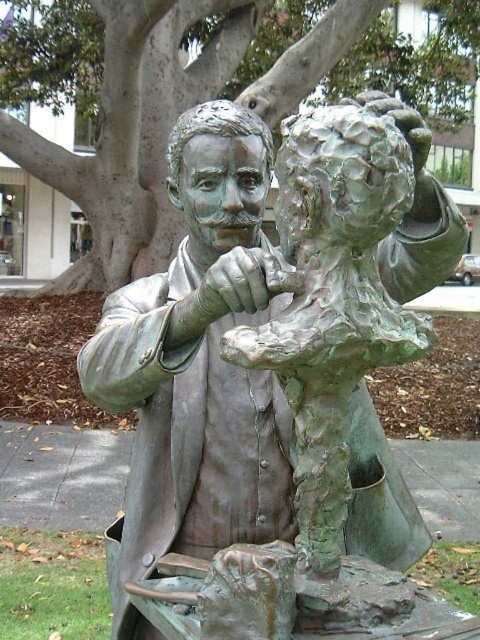
What do you see at coordinates (197, 365) in the screenshot? The height and width of the screenshot is (640, 480). I see `green patina bronze statue at center` at bounding box center [197, 365].

Between green patina bronze statue at center and green textured tree at upper center, which one has more height?

Standing taller between the two is green textured tree at upper center.

Does point (252, 276) come behind point (457, 129)?

No, (252, 276) is closer to viewer.

Locate an element on the screen. This screenshot has height=640, width=480. green patina bronze statue at center is located at coordinates (197, 365).